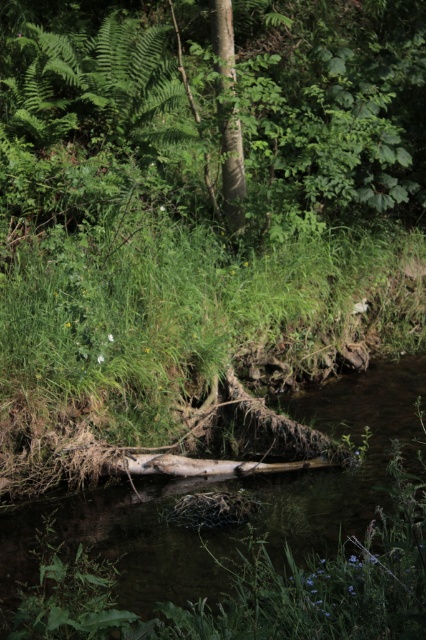
Question: Among these points, which one is nearest to the camera?

Choices:
 (A) (127, 636)
 (B) (236, 179)

Answer: (A)

Question: Is brown wood log at center to the left of smooth bark tree trunk at center from the viewer's perspective?

Choices:
 (A) yes
 (B) no

Answer: (B)

Question: Can you confirm if brown wood log at center is positioned to the left of smooth bark tree trunk at center?

Choices:
 (A) yes
 (B) no

Answer: (B)

Question: Is brown wood log at center positioned before smooth bark tree trunk at center?

Choices:
 (A) yes
 (B) no

Answer: (A)

Question: Which object is closer to the camera taking this photo?

Choices:
 (A) smooth bark tree trunk at center
 (B) brown wood log at center

Answer: (B)

Question: Which object appears farthest from the camera in this image?

Choices:
 (A) smooth bark tree trunk at center
 (B) brown wood log at center

Answer: (A)